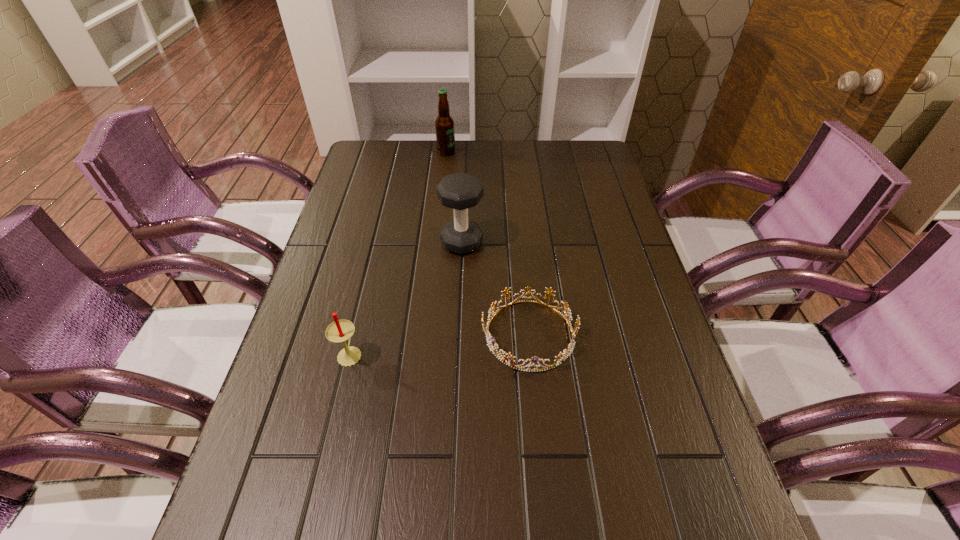
You are a GUI agent. You are given a task and a screenshot of the screen. Output one action in this format:
    pyautogui.click(x=<x>, y=<y>)
    Task: Click on the free space between the shortest object and the leftmost object
    The image size is (960, 540).
    Given the screenshot: What is the action you would take?
    pyautogui.click(x=440, y=344)

The image size is (960, 540). What are the coordinates of `free space between the shortest object and the beer bottle` in the screenshot? It's located at [x=488, y=243].

The height and width of the screenshot is (540, 960). Find the location of `vacant region between the third tallest object and the third nearest object`. vacant region between the third tallest object and the third nearest object is located at coordinates (406, 298).

Locate an element on the screen. The image size is (960, 540). empty location between the beer bottle and the tiara is located at coordinates (488, 243).

Where is `free space between the farthest object and the leftmost object`? This screenshot has height=540, width=960. free space between the farthest object and the leftmost object is located at coordinates (398, 253).

Locate an element on the screen. Image resolution: width=960 pixels, height=540 pixels. free space that is in between the second farthest object and the leftmost object is located at coordinates (406, 298).

At what (x,y) coordinates should I click in order to perform the action: click on object that is the third closest to the third tallest object. Please return your answer as a coordinate pair (x, y). The height and width of the screenshot is (540, 960). Looking at the image, I should click on (445, 135).

The width and height of the screenshot is (960, 540). Find the location of `object identified as the third closest to the leftmost object`. object identified as the third closest to the leftmost object is located at coordinates (445, 135).

At what (x,y) coordinates should I click in order to perform the action: click on free location that satisfies the following two spatial constraints: 1. on the front-facing side of the shortest object; 2. on the front side of the candle. Please return your answer as a coordinate pair (x, y). Looking at the image, I should click on (531, 354).

The image size is (960, 540). Find the location of `vacant space that satisfies the following two spatial constraints: 1. on the back side of the dumbbell; 2. on the label of the farthest object`. vacant space that satisfies the following two spatial constraints: 1. on the back side of the dumbbell; 2. on the label of the farthest object is located at coordinates (466, 152).